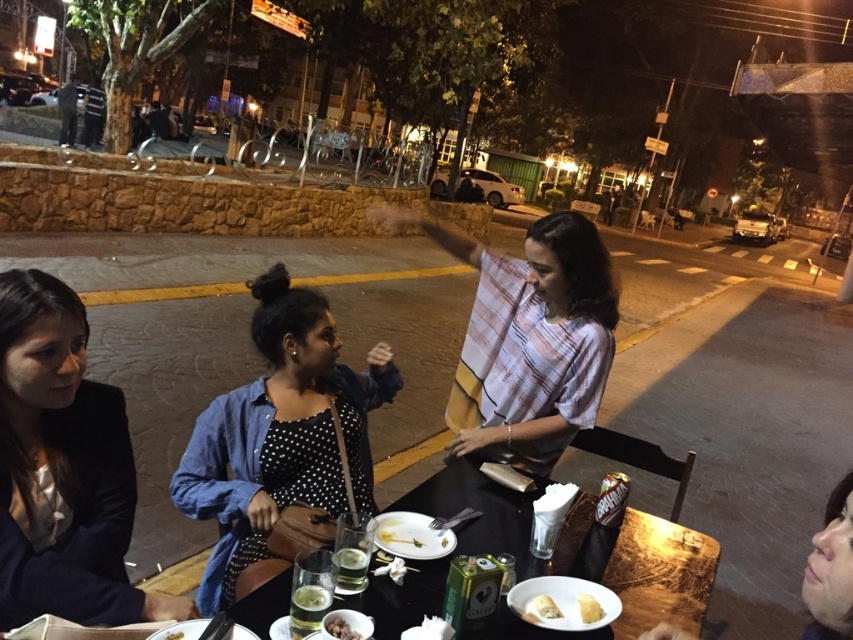
Question: Does black wood table at center appear over translucent glass at table center?

Choices:
 (A) yes
 (B) no

Answer: (B)

Question: Which of these objects is positioned closest to the smooth brown bread at center?

Choices:
 (A) dark blue blazer at lower left
 (B) white creamy cake at center

Answer: (B)

Question: Can you confirm if dark blue blazer at lower left is smaller than black wood table at center?

Choices:
 (A) no
 (B) yes

Answer: (B)

Question: Which object appears closest to the camera in this image?

Choices:
 (A) white matte plate at center
 (B) translucent glass at table center
 (C) translucent glass cup at table center
 (D) plaid cotton shirt at center

Answer: (B)

Question: Which point appears closest to the camera in this image?

Choices:
 (A) (337, 620)
 (B) (547, 604)
 (C) (316, 609)
 (D) (340, 566)

Answer: (A)

Question: Can you confirm if translucent glass at table center is positioned to the right of white creamy bread at lower center?

Choices:
 (A) yes
 (B) no

Answer: (B)